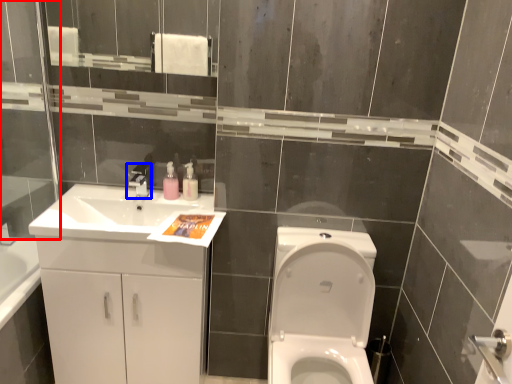
Question: Which point is closer to the camera, glass door (highlighted by a red box) or tap (highlighted by a blue box)?

Choices:
 (A) glass door
 (B) tap

Answer: (A)